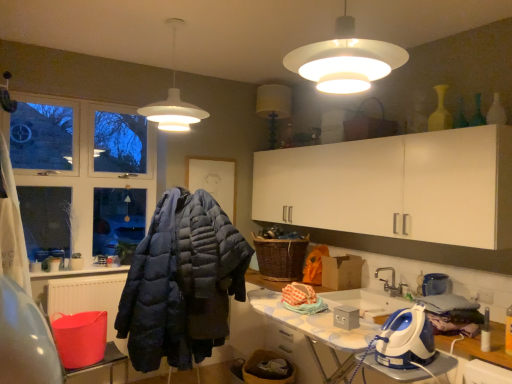
The width and height of the screenshot is (512, 384). What are the coordinates of `empty space that is ontop of white matte pendant light at upper center, which is counted as the 1th lamp, starting from the left (from a real-world perspective)` in the screenshot? It's located at (179, 19).